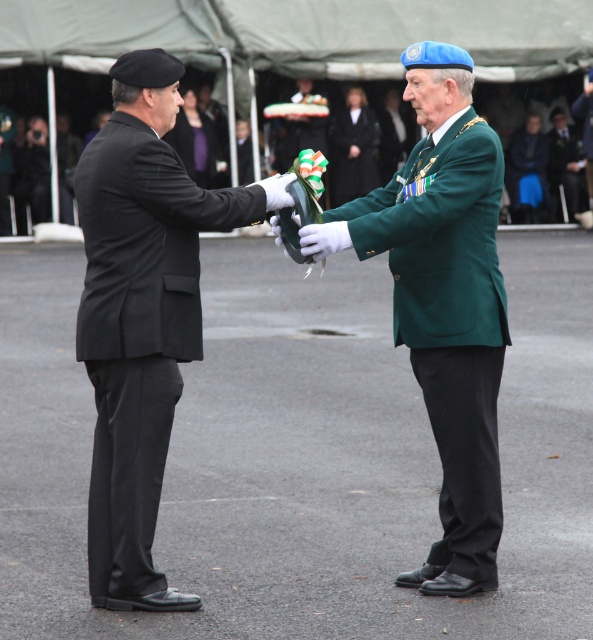
Question: Which object is farther from the camera taking this photo?

Choices:
 (A) green fabric uniform at center
 (B) black wool beret at upper center

Answer: (A)

Question: Which point appears farthest from the camera in this image?

Choices:
 (A) (495, 314)
 (B) (307, 132)

Answer: (B)

Question: Is green textured suit at center above black wool beret at upper center?

Choices:
 (A) yes
 (B) no

Answer: (B)

Question: Is black matte suit at left above green uniform at center?

Choices:
 (A) no
 (B) yes

Answer: (A)

Question: Which point appears farthest from the camera in this image?

Choices:
 (A) (556, 180)
 (B) (585, 220)
 (C) (514, 195)

Answer: (A)

Question: Does blue fabric pants at lower right appear on the right side of green fabric uniform at center?

Choices:
 (A) no
 (B) yes

Answer: (A)